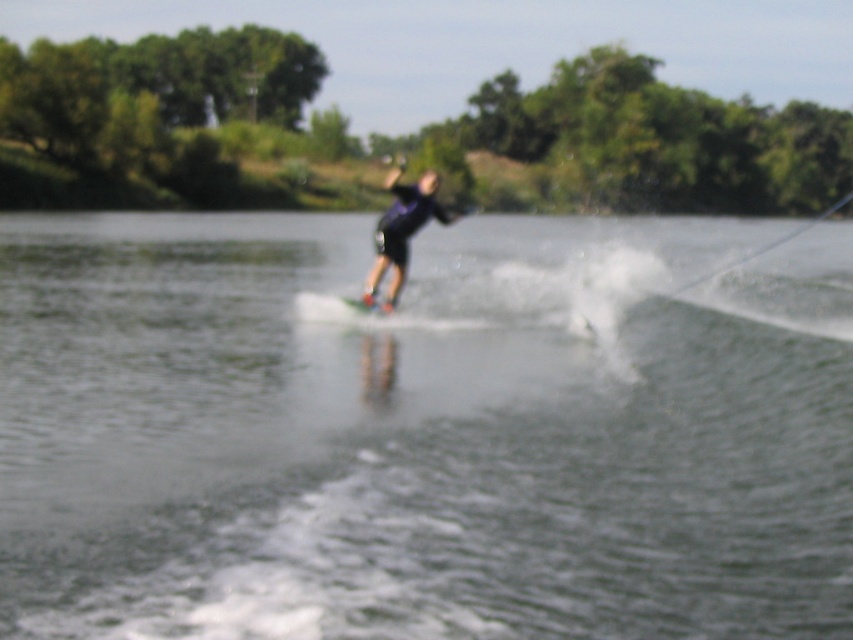
Consider the image. You are a safety officer on a boat and need to ensure the distance between the clear water at center and the white matte water ski at center is within the safe range of 10 meters. Is the current distance safe?

The clear water at center is 15.22 meters from the white matte water ski at center, which exceeds the safe range of 10 meters. Therefore, the current distance is not safe.

You are a photographer trying to capture the perfect shot of the dark blue fabric at center and the white matte water ski at center. You need to ensure that both objects are fully visible in your frame. Given that your camera has a fixed focal length, which object should you prioritize framing first to accommodate their sizes?

The dark blue fabric at center is wider than the white matte water ski at center, so you should prioritize framing the dark blue fabric at center first to ensure it fits within the camera frame.

You are a photographer trying to capture the perfect shot of the wakeboarder. You notice the clear water at center and dark blue fabric at center. Which object is wider in the image?

The clear water at center is wider than the dark blue fabric at center according to the description.